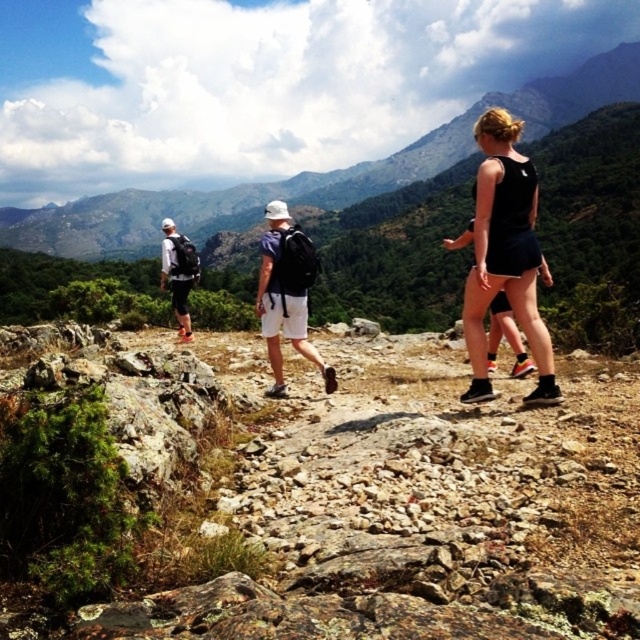
Who is more forward, (506, 241) or (163, 264)?

Point (506, 241) is in front.

Is matte black shorts at center shorter than matte black backpack at left?

Yes, matte black shorts at center is shorter than matte black backpack at left.

Where is `matte black shorts at center`? This screenshot has height=640, width=640. matte black shorts at center is located at coordinates (504, 256).

Between green grassy mountain at upper center and matte black shorts at center, which one appears on the right side from the viewer's perspective?

Positioned to the right is green grassy mountain at upper center.

From the picture: Measure the distance between green grassy mountain at upper center and matte black shorts at center.

green grassy mountain at upper center and matte black shorts at center are 764.54 feet apart from each other.

Image resolution: width=640 pixels, height=640 pixels. Find the location of `green grassy mountain at upper center`. green grassy mountain at upper center is located at coordinates (310, 173).

Where is `green grassy mountain at upper center`? green grassy mountain at upper center is located at coordinates (310, 173).

Looking at this image, who is shorter, black matte tank top at center or white matte backpack at center?

With less height is white matte backpack at center.

Can you confirm if black matte tank top at center is taller than white matte backpack at center?

Yes, black matte tank top at center is taller than white matte backpack at center.

Which is behind, point (488, 113) or point (300, 273)?

The point (300, 273) is more distant.

The image size is (640, 640). In order to click on black matte tank top at center in this screenshot , I will do `click(504, 253)`.